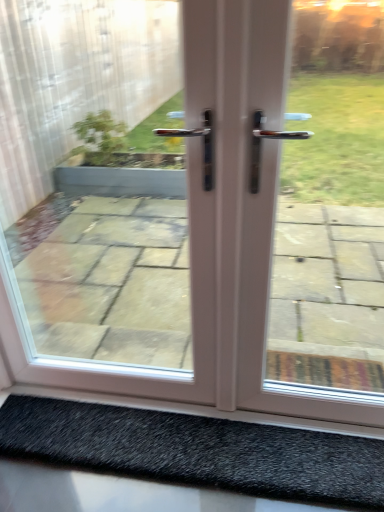
Where is `black shaggy mat at lower center`? black shaggy mat at lower center is located at coordinates (196, 451).

What is the approximate width of black shaggy mat at lower center?

It is 10.27 inches.

Describe the element at coordinates (196, 451) in the screenshot. I see `black shaggy mat at lower center` at that location.

The height and width of the screenshot is (512, 384). I want to click on black shaggy mat at lower center, so click(x=196, y=451).